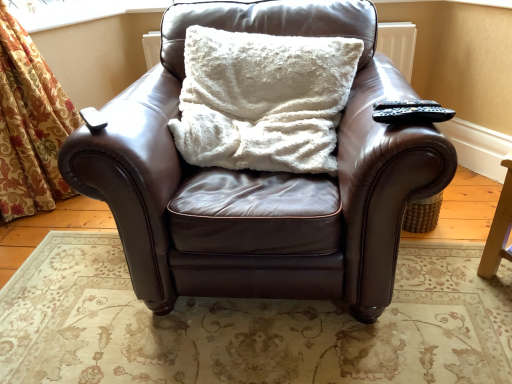
I want to click on black plastic remote at upper right, so click(413, 114).

Locate an element on the screen. transparent plastic window screen at upper left is located at coordinates tap(75, 11).

Describe the element at coordinates (263, 100) in the screenshot. I see `white fluffy pillow at center` at that location.

Locate an element on the screen. The height and width of the screenshot is (384, 512). black plastic remote at upper right is located at coordinates (413, 114).

Which is more to the left, white fluffy pillow at center or transparent plastic window screen at upper left?

From the viewer's perspective, transparent plastic window screen at upper left appears more on the left side.

Is transparent plastic window screen at upper left located within white fluffy pillow at center?

No, transparent plastic window screen at upper left is not inside white fluffy pillow at center.

Is white fluffy pillow at center oriented towards transparent plastic window screen at upper left?

No, white fluffy pillow at center is not turned towards transparent plastic window screen at upper left.

Looking at this image, which is more to the right, black plastic remote at upper right or brown leather chair at center?

Positioned to the right is black plastic remote at upper right.

Find the location of a particular element. The width and height of the screenshot is (512, 384). chair located underneath the black plastic remote at upper right (from a real-world perspective) is located at coordinates (260, 179).

Can you confirm if black plastic remote at upper right is taller than brown leather chair at center?

No, black plastic remote at upper right is not taller than brown leather chair at center.

Is point (442, 111) positioned before point (138, 131)?

Yes.

Is brown leather chair at center far from transparent plastic window screen at upper left?

Yes, brown leather chair at center is far from transparent plastic window screen at upper left.

Is brown leather chair at center bigger than transparent plastic window screen at upper left?

Yes, brown leather chair at center is bigger than transparent plastic window screen at upper left.

From the image's perspective, would you say brown leather chair at center is positioned over transparent plastic window screen at upper left?

No, from the image's perspective, brown leather chair at center is not above transparent plastic window screen at upper left.

Is brown leather chair at center not within transparent plastic window screen at upper left?

brown leather chair at center lies outside transparent plastic window screen at upper left's area.

This screenshot has height=384, width=512. What are the coordinates of `window screen above the black plastic remote at upper right (from the image's perspective)` in the screenshot? It's located at (75, 11).

Is transparent plastic window screen at upper left at the right side of black plastic remote at upper right?

Incorrect, transparent plastic window screen at upper left is not on the right side of black plastic remote at upper right.

Does point (78, 15) come in front of point (400, 110)?

No.

In the scene shown: Is transparent plastic window screen at upper left oriented away from black plastic remote at upper right?

transparent plastic window screen at upper left does not have its back to black plastic remote at upper right.

Is brown leather chair at center wider than white fluffy pillow at center?

Yes.

Is white fluffy pillow at center located within brown leather chair at center?

Indeed, white fluffy pillow at center is located within brown leather chair at center.

How far apart are brown leather chair at center and white fluffy pillow at center?

They are 6.90 inches apart.

Is brown leather chair at center taller or shorter than white fluffy pillow at center?

In the image, brown leather chair at center appears to be taller than white fluffy pillow at center.

From the image's perspective, which object appears higher, black plastic remote at upper right or transparent plastic window screen at upper left?

transparent plastic window screen at upper left, from the image's perspective.

Are black plastic remote at upper right and transparent plastic window screen at upper left making contact?

No, black plastic remote at upper right is not next to transparent plastic window screen at upper left.

Who is more distant, black plastic remote at upper right or transparent plastic window screen at upper left?

transparent plastic window screen at upper left is more distant.

Looking at this image, is transparent plastic window screen at upper left smaller than brown leather chair at center?

Yes.

Considering the points (91, 9) and (390, 150), which point is behind, point (91, 9) or point (390, 150)?

Point (91, 9)

Considering the sizes of transparent plastic window screen at upper left and brown leather chair at center in the image, is transparent plastic window screen at upper left taller or shorter than brown leather chair at center?

transparent plastic window screen at upper left is shorter than brown leather chair at center.

You are a GUI agent. You are given a task and a screenshot of the screen. Output one action in this format:
    pyautogui.click(x=<x>, y=<y>)
    Task: Click on the pillow beneath the transparent plastic window screen at upper left (from a real-world perspective)
    
    Given the screenshot: What is the action you would take?
    pyautogui.click(x=263, y=100)

The width and height of the screenshot is (512, 384). Identify the location of chair lying in front of the black plastic remote at upper right. (260, 179).

Based on their spatial positions, is black plastic remote at upper right or brown leather chair at center closer to white fluffy pillow at center?

The object closer to white fluffy pillow at center is brown leather chair at center.

When comparing their distances from transparent plastic window screen at upper left, does white fluffy pillow at center or black plastic remote at upper right seem further?

Among the two, black plastic remote at upper right is located further to transparent plastic window screen at upper left.

Considering their positions, is white fluffy pillow at center positioned further to black plastic remote at upper right than transparent plastic window screen at upper left?

transparent plastic window screen at upper left.

From the image, which object appears to be farther from white fluffy pillow at center, transparent plastic window screen at upper left or black plastic remote at upper right?

transparent plastic window screen at upper left.

Looking at the image, which one is located further to white fluffy pillow at center, brown leather chair at center or black plastic remote at upper right?

Based on the image, black plastic remote at upper right appears to be further to white fluffy pillow at center.

From the image, which object appears to be farther from black plastic remote at upper right, transparent plastic window screen at upper left or brown leather chair at center?

The object further to black plastic remote at upper right is transparent plastic window screen at upper left.

When comparing their distances from black plastic remote at upper right, does white fluffy pillow at center or brown leather chair at center seem closer?

white fluffy pillow at center is closer to black plastic remote at upper right.

When comparing their distances from black plastic remote at upper right, does brown leather chair at center or white fluffy pillow at center seem further?

Among the two, brown leather chair at center is located further to black plastic remote at upper right.

In order to click on chair situated between transparent plastic window screen at upper left and white fluffy pillow at center from left to right in this screenshot , I will do `click(260, 179)`.

This screenshot has width=512, height=384. Find the location of `pillow located between brown leather chair at center and black plastic remote at upper right in the left-right direction`. pillow located between brown leather chair at center and black plastic remote at upper right in the left-right direction is located at coordinates (263, 100).

I want to click on pillow between transparent plastic window screen at upper left and black plastic remote at upper right, so click(x=263, y=100).

The image size is (512, 384). Identify the location of chair between transparent plastic window screen at upper left and black plastic remote at upper right from left to right. (260, 179).